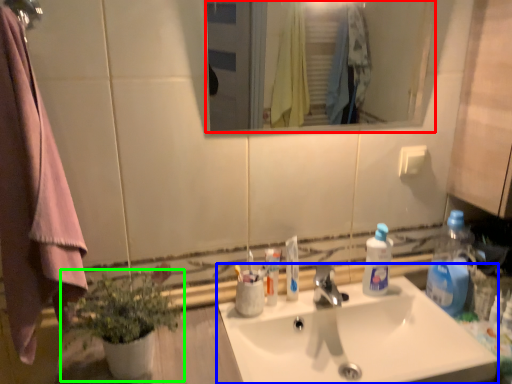
Question: Which object is the closest to the mirror (highlighted by a red box)? Choose among these: sink (highlighted by a blue box) or houseplant (highlighted by a green box).

Choices:
 (A) sink
 (B) houseplant

Answer: (A)